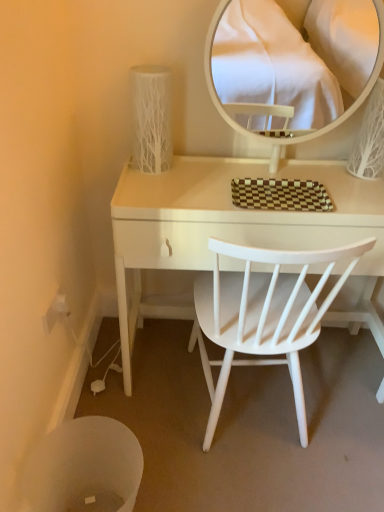
Locate an element on the screen. The image size is (384, 512). free space between white glossy mirror at upper center and white textured vase at upper left is located at coordinates (220, 166).